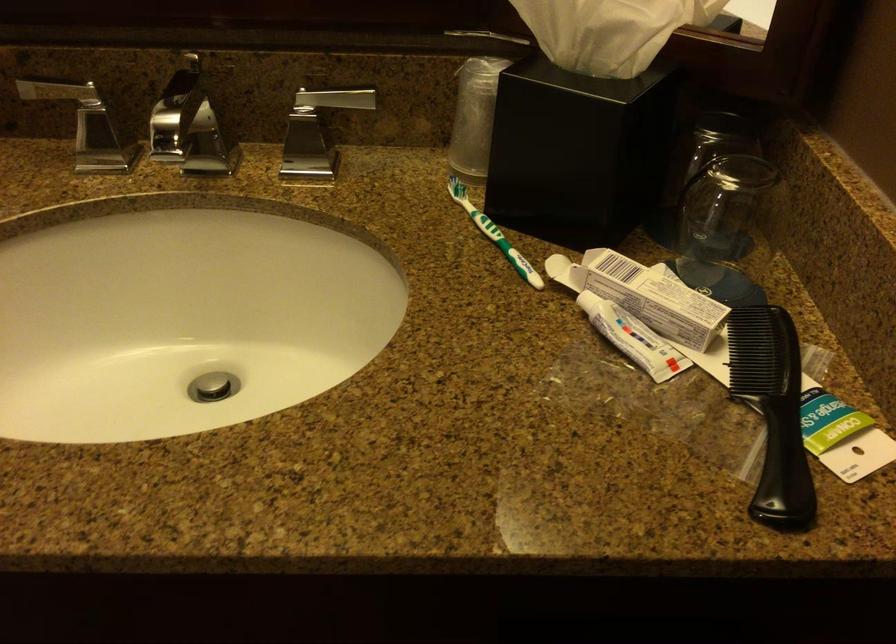
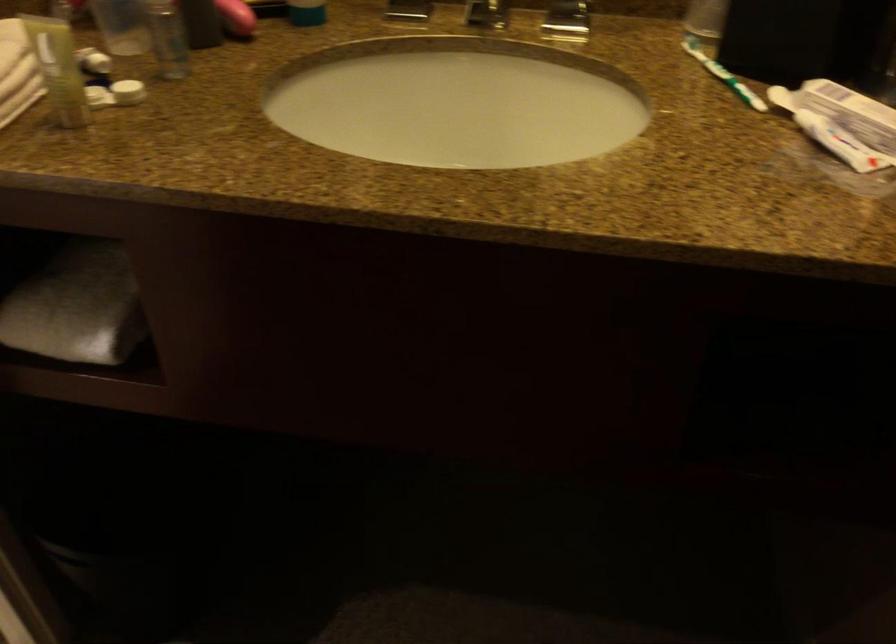
Question: I am providing you with two images of the same scene from different viewpoints. After the viewpoint changes to image2, which objects are now occluded?

Choices:
 (A) silver faucet handle
 (B) office chair seat
 (C) sink drain stopper
 (D) white container lid

Answer: (C)